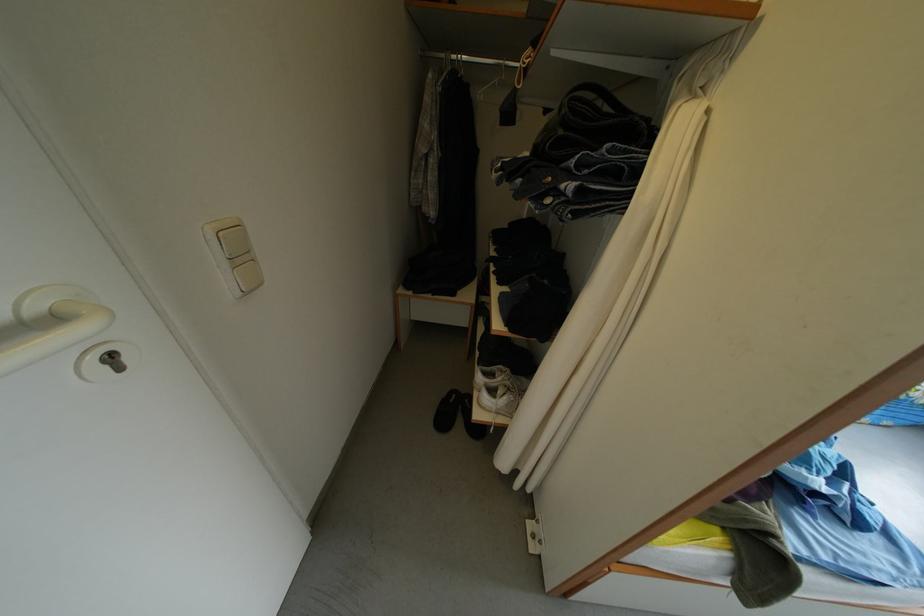
The height and width of the screenshot is (616, 924). What do you see at coordinates (106, 363) in the screenshot? I see `the door keyhole` at bounding box center [106, 363].